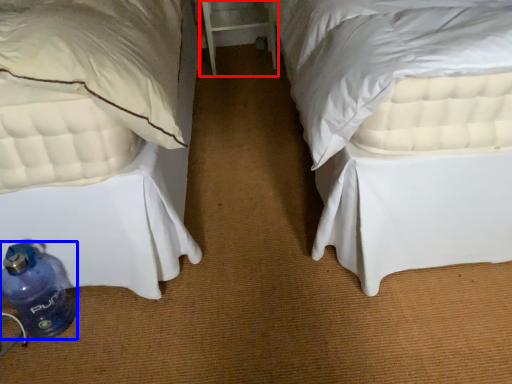
Question: Which point is closer to the camera, table (highlighted by a red box) or bottle (highlighted by a blue box)?

Choices:
 (A) table
 (B) bottle

Answer: (B)